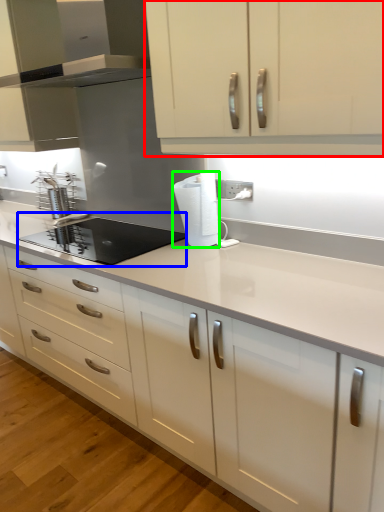
Question: Which object is positioned farthest from cabinetry (highlighted by a red box)? Select from kitchen appliance (highlighted by a blue box) and paper towel (highlighted by a green box).

Choices:
 (A) kitchen appliance
 (B) paper towel

Answer: (A)